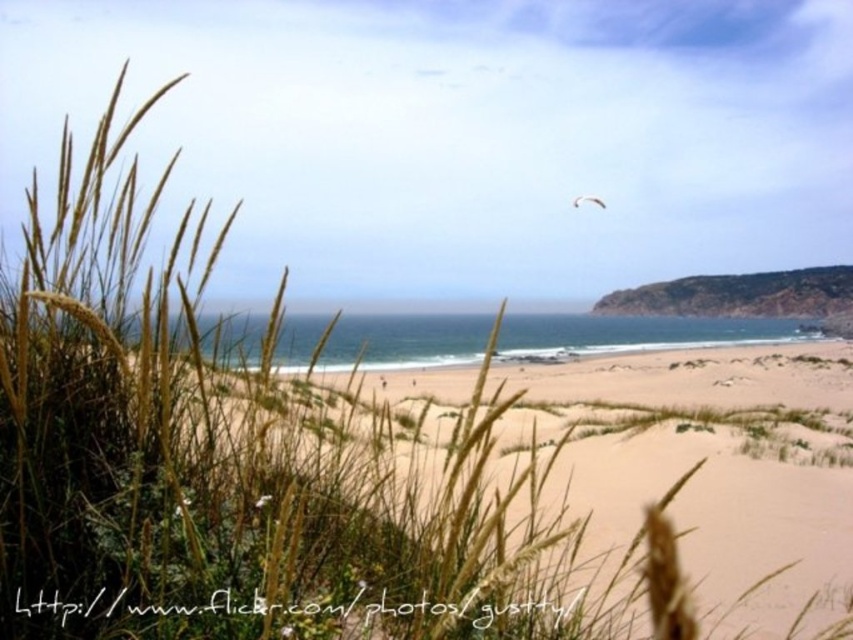
You are standing on the light brown sandy beach at center and looking towards the white feathered bird at upper center. Which object appears closer to you in the image?

The light brown sandy beach at center appears closer to you because it has a smaller size compared to the white feathered bird at upper center, which is usually an indicator of distance in perspective.